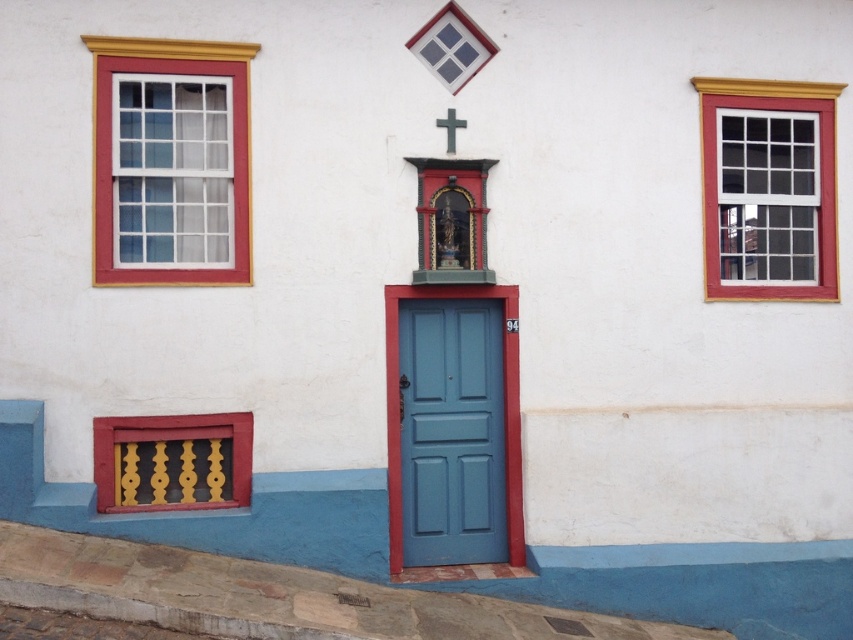
You are an interior designer planning to install a new light fixture. You have two options based on the objects in the scene. Which object, the white glass window at right or the white matte cross at upper center, would require a larger fixture to match its size?

The white glass window at right is bigger than the white matte cross at upper center, so a larger light fixture would be needed to match the size of the white glass window at right.

You are standing in front of the building and want to enter through the blue matte door at center. Which direction should you walk relative to the white glass window at right to reach the door?

To reach the blue matte door at center from the white glass window at right, you should walk to the left since the white glass window at right is positioned to the right of the door.